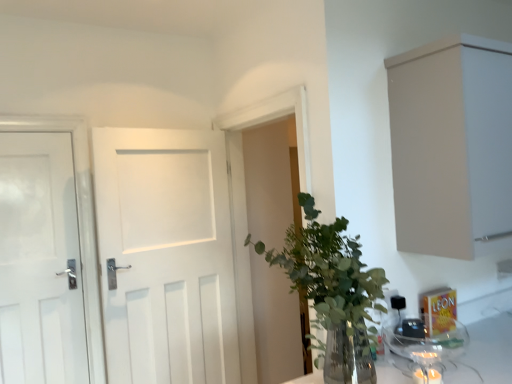
Question: In terms of width, does green leafy plant at center look wider or thinner when compared to beige matte cabinet at upper right?

Choices:
 (A) wide
 (B) thin

Answer: (B)

Question: From a real-world perspective, is green leafy plant at center above or below beige matte cabinet at upper right?

Choices:
 (A) above
 (B) below

Answer: (B)

Question: Which is farther from the white matte door at center, the second door when ordered from left to right?

Choices:
 (A) green leafy plant at center
 (B) white matte door at left, which ranks as the 2th door in right-to-left order
 (C) beige matte cabinet at upper right
 (D) transparent glass jar at lower right

Answer: (C)

Question: Estimate the real-world distances between objects in this image. Which object is farther from the beige matte cabinet at upper right?

Choices:
 (A) green leafy plant at center
 (B) white matte door at left, positioned as the first door in left-to-right order
 (C) transparent glass jar at lower right
 (D) white matte door at center, the first door positioned from the right

Answer: (B)